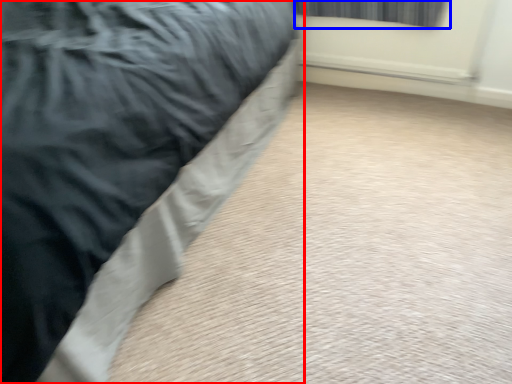
Question: Among these objects, which one is farthest to the camera, bed (highlighted by a red box) or curtain (highlighted by a blue box)?

Choices:
 (A) bed
 (B) curtain

Answer: (B)